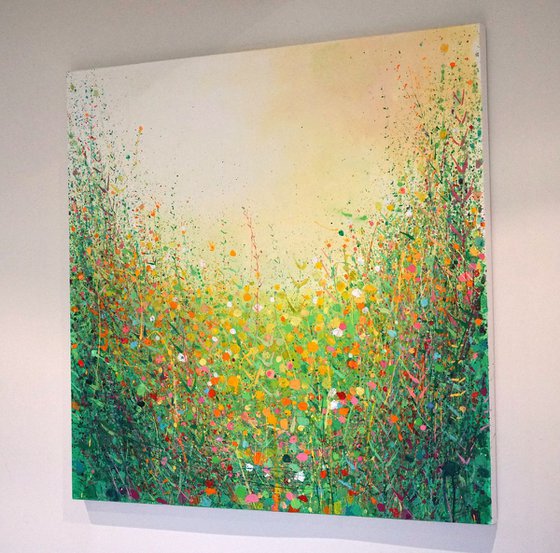
Where is `clear wall to the left of painting`? clear wall to the left of painting is located at coordinates (18, 320).